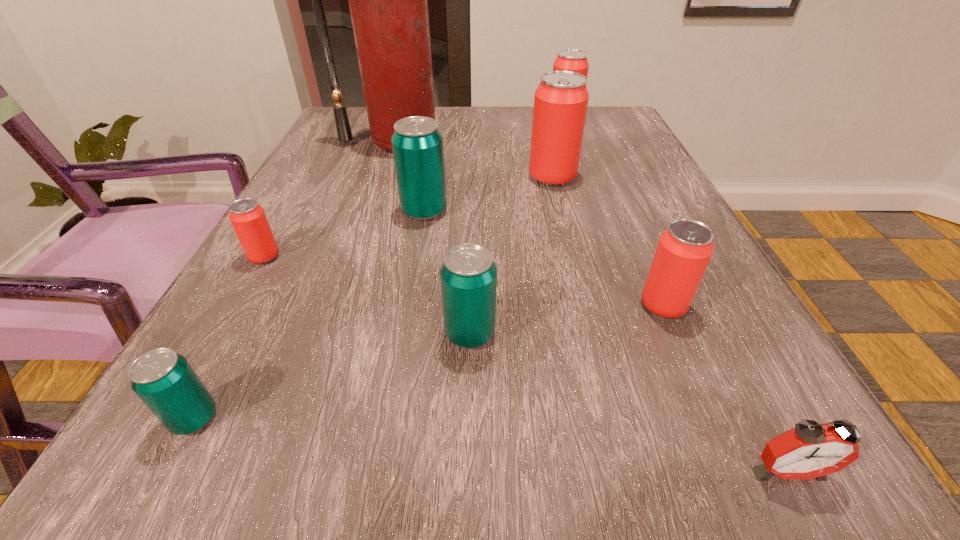
In order to click on free space located 0.060m on the front of the nearest red beer can in this screenshot , I will do `click(685, 357)`.

Locate an element on the screen. Image resolution: width=960 pixels, height=540 pixels. vacant space situated 0.110m on the right of the fourth beer can from right to left is located at coordinates (577, 333).

This screenshot has width=960, height=540. Find the location of `vacant space situated 0.310m on the right of the leftmost teal beer can`. vacant space situated 0.310m on the right of the leftmost teal beer can is located at coordinates (489, 418).

Where is `blank space located 0.310m on the front of the leftmost red beer can`? This screenshot has width=960, height=540. blank space located 0.310m on the front of the leftmost red beer can is located at coordinates (151, 456).

You are a GUI agent. You are given a task and a screenshot of the screen. Output one action in this format:
    pyautogui.click(x=<x>, y=<y>)
    Task: Click on the fire extinguisher located at the far edge
    Image resolution: width=960 pixels, height=540 pixels.
    Given the screenshot: What is the action you would take?
    pyautogui.click(x=388, y=4)

You are a GUI agent. You are given a task and a screenshot of the screen. Output one action in this format:
    pyautogui.click(x=<x>, y=<y>)
    Task: Click on the beer can that is at the far edge
    The height and width of the screenshot is (540, 960).
    Given the screenshot: What is the action you would take?
    pyautogui.click(x=574, y=60)

Where is `beer can positioned at the near edge`? This screenshot has height=540, width=960. beer can positioned at the near edge is located at coordinates (164, 380).

Where is `alarm clock located at the near edge`? alarm clock located at the near edge is located at coordinates (810, 450).

The width and height of the screenshot is (960, 540). I want to click on fire extinguisher that is at the left edge, so click(388, 4).

Where is `alarm clock located at the right edge`? alarm clock located at the right edge is located at coordinates (810, 450).